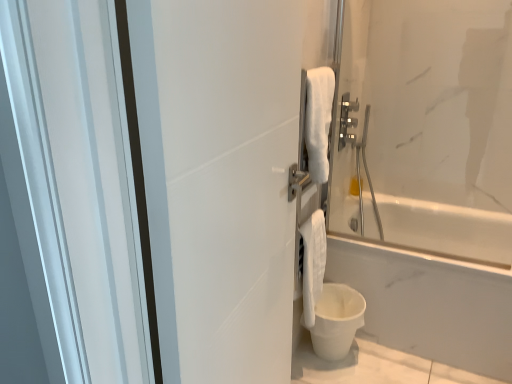
Question: From the image's perspective, would you say white matte screen door at center is positioned over white matte bucket at lower right?

Choices:
 (A) yes
 (B) no

Answer: (A)

Question: From the image's perspective, does white matte screen door at center appear lower than white matte bucket at lower right?

Choices:
 (A) yes
 (B) no

Answer: (B)

Question: Is white matte bucket at lower right located within white matte screen door at center?

Choices:
 (A) yes
 (B) no

Answer: (B)

Question: Is white matte screen door at center not within white matte bucket at lower right?

Choices:
 (A) no
 (B) yes

Answer: (B)

Question: Is white matte screen door at center next to white matte bucket at lower right?

Choices:
 (A) yes
 (B) no

Answer: (B)

Question: Is point (193, 41) positioned closer to the camera than point (346, 319)?

Choices:
 (A) farther
 (B) closer

Answer: (B)

Question: Considering the positions of white matte screen door at center and white matte bucket at lower right in the image, is white matte screen door at center bigger or smaller than white matte bucket at lower right?

Choices:
 (A) small
 (B) big

Answer: (B)

Question: In terms of height, does white matte screen door at center look taller or shorter compared to white matte bucket at lower right?

Choices:
 (A) short
 (B) tall

Answer: (B)

Question: From the image's perspective, is white matte screen door at center located above or below white matte bucket at lower right?

Choices:
 (A) above
 (B) below

Answer: (A)

Question: Is white soft towel at lower right in front of or behind white matte screen door at center in the image?

Choices:
 (A) behind
 (B) front

Answer: (A)

Question: Considering the positions of white soft towel at lower right and white matte screen door at center in the image, is white soft towel at lower right wider or thinner than white matte screen door at center?

Choices:
 (A) thin
 (B) wide

Answer: (A)

Question: Considering the positions of point (304, 241) and point (174, 249), is point (304, 241) closer or farther from the camera than point (174, 249)?

Choices:
 (A) closer
 (B) farther

Answer: (B)

Question: In the image, is white soft towel at lower right on the left side or the right side of white matte screen door at center?

Choices:
 (A) left
 (B) right

Answer: (B)

Question: Is white matte bucket at lower right inside or outside of white soft towel at lower right?

Choices:
 (A) inside
 (B) outside

Answer: (B)

Question: In the image, is white matte bucket at lower right positioned in front of or behind white soft towel at lower right?

Choices:
 (A) front
 (B) behind

Answer: (B)